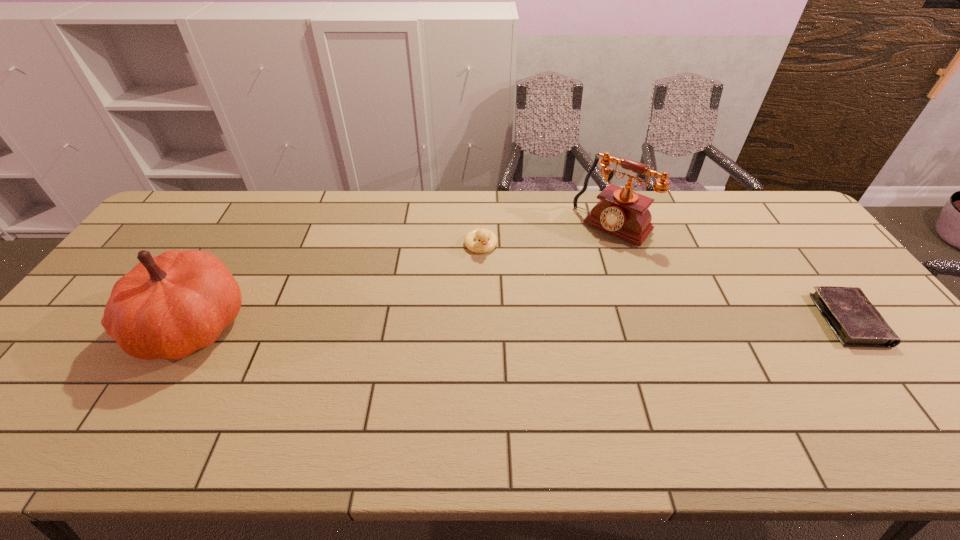
Identify the location of object present at the right edge. The width and height of the screenshot is (960, 540). (854, 320).

The width and height of the screenshot is (960, 540). Identify the location of object present at the near left corner. (167, 307).

Where is `free region at the far edge of the desktop`? free region at the far edge of the desktop is located at coordinates (475, 216).

Identify the location of vacant space at the near edge of the desktop. The height and width of the screenshot is (540, 960). (174, 401).

Where is `vacant region at the far left corner of the desktop`? The height and width of the screenshot is (540, 960). vacant region at the far left corner of the desktop is located at coordinates (210, 205).

Identify the location of free space at the far right corner of the desktop. Image resolution: width=960 pixels, height=540 pixels. pos(773,205).

I want to click on vacant point located between the duckling and the diary, so click(x=664, y=283).

Identify the location of blank region between the duckling and the leftmost object. The width and height of the screenshot is (960, 540). (337, 285).

In order to click on free space that is in between the leftmost object and the second object from right to left in this screenshot , I will do `click(403, 276)`.

Where is `empty location between the third object from left to right and the rightmost object`? Image resolution: width=960 pixels, height=540 pixels. empty location between the third object from left to right and the rightmost object is located at coordinates (731, 273).